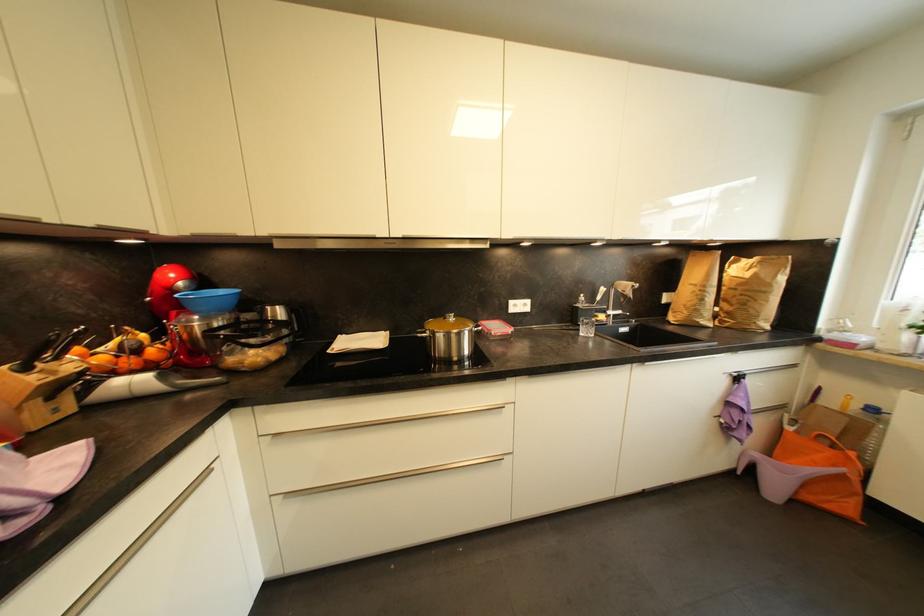
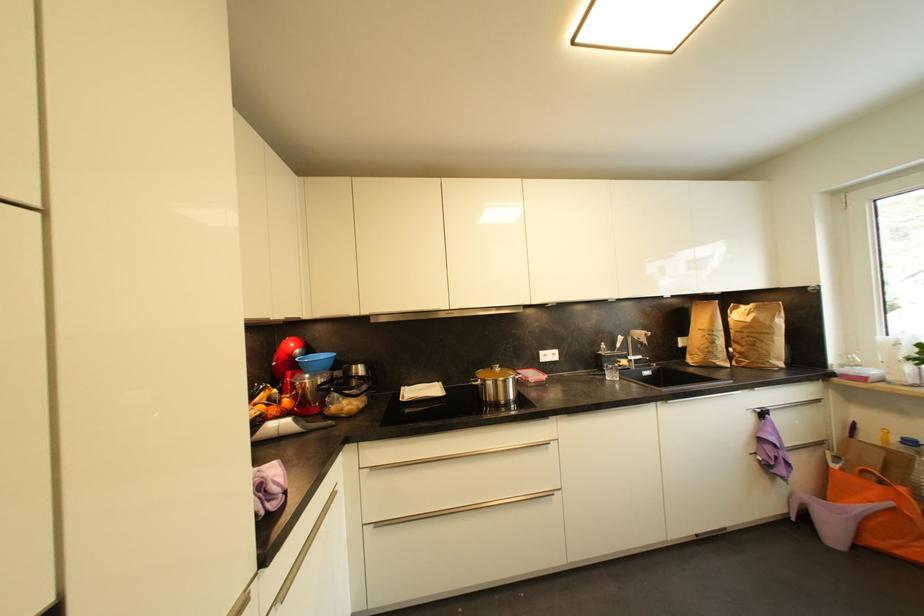
Find the pixel in the second image that matches point (492, 322) in the first image.

(528, 371)